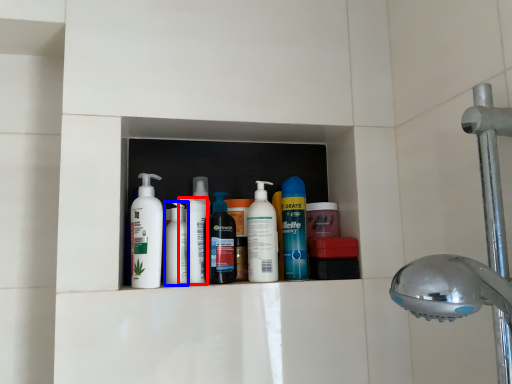
Question: Which point is closer to the camera, cleaning product (highlighted by a red box) or toiletry (highlighted by a blue box)?

Choices:
 (A) cleaning product
 (B) toiletry

Answer: (A)